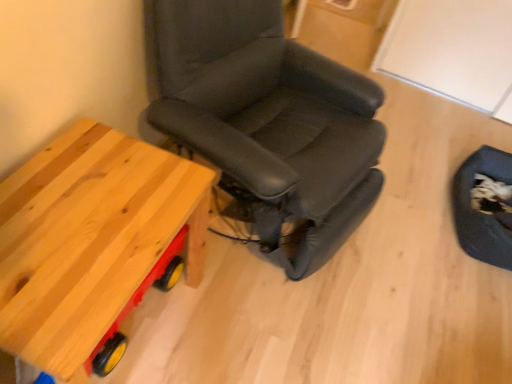
Image resolution: width=512 pixels, height=384 pixels. Find the location of `blank space situated above natural wood table at left (from a real-world perspective)`. blank space situated above natural wood table at left (from a real-world perspective) is located at coordinates (82, 216).